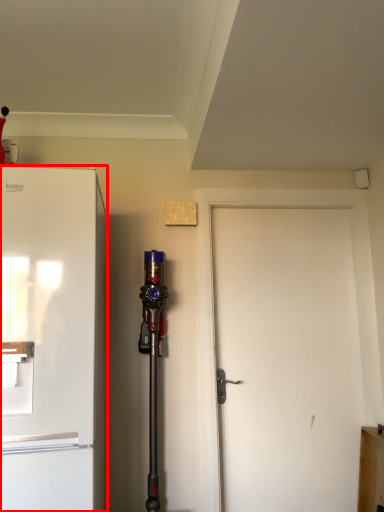
Question: From the image's perspective, where is refrigerator (annotated by the red box) located relative to door?

Choices:
 (A) below
 (B) above

Answer: (B)